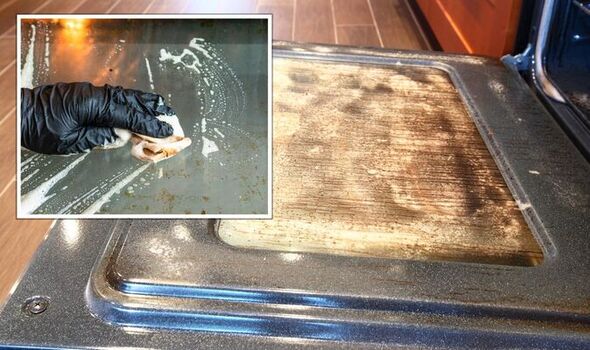
Where is `oven hinge`? This screenshot has height=350, width=590. oven hinge is located at coordinates (517, 64).